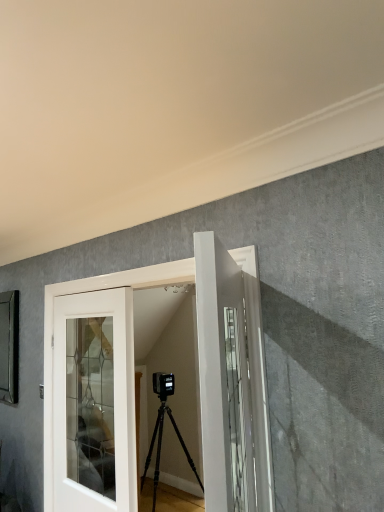
Measure the distance between point [114,305] and camera.

Point [114,305] is 2.16 meters from camera.

This screenshot has width=384, height=512. Find the location of `white glass door at center, which is the first door from back to front`. white glass door at center, which is the first door from back to front is located at coordinates (95, 396).

From a real-world perspective, is white glossy door at center, the second door viewed from the back, on white glass door at center, which is the first door from back to front?

Indeed, from a real-world perspective, white glossy door at center, the second door viewed from the back, stands above white glass door at center, which is the first door from back to front.

Considering the positions of objects white glossy door at center, the second door viewed from the back, and white glass door at center, which is the first door from back to front, in the image provided, who is more to the left, white glossy door at center, the second door viewed from the back, or white glass door at center, which is the first door from back to front,?

white glass door at center, which is the first door from back to front, is more to the left.

Looking at their sizes, would you say white glossy door at center, the 2th door viewed from the front, is wider or thinner than white glass door at center, marked as the third door in a front-to-back arrangement?

white glossy door at center, the 2th door viewed from the front, is wider than white glass door at center, marked as the third door in a front-to-back arrangement.

From the image's perspective, is white glossy door at center, the second door viewed from the back, located above white glossy door at center, placed as the third door when sorted from back to front?

Actually, white glossy door at center, the second door viewed from the back, appears below white glossy door at center, placed as the third door when sorted from back to front, in the image.

Considering the sizes of white glossy door at center, the second door viewed from the back, and white glossy door at center, placed as the third door when sorted from back to front, in the image, is white glossy door at center, the second door viewed from the back, wider or thinner than white glossy door at center, placed as the third door when sorted from back to front,?

In the image, white glossy door at center, the second door viewed from the back, appears to be wider than white glossy door at center, placed as the third door when sorted from back to front.

Considering the sizes of objects white glossy door at center, the second door viewed from the back, and white glossy door at center, which is the 1th door from front to back, in the image provided, who is smaller, white glossy door at center, the second door viewed from the back, or white glossy door at center, which is the 1th door from front to back,?

Smaller between the two is white glossy door at center, which is the 1th door from front to back.

Can you confirm if white glossy door at center, the 2th door viewed from the front, is positioned to the right of white glossy door at center, which is the 1th door from front to back?

No, white glossy door at center, the 2th door viewed from the front, is not to the right of white glossy door at center, which is the 1th door from front to back.

From the picture: Can you confirm if white glossy door at center, which is the 1th door from front to back, is shorter than white glossy door at center, the second door viewed from the back?

Yes.

Would you say white glossy door at center, which is the 1th door from front to back, is outside white glossy door at center, the second door viewed from the back?

Yes.

Are white glossy door at center, which is the 1th door from front to back, and white glossy door at center, the 2th door viewed from the front, located far from each other?

No, white glossy door at center, which is the 1th door from front to back, is not far from white glossy door at center, the 2th door viewed from the front.

Is white glass door at center, marked as the third door in a front-to-back arrangement, not inside white glossy door at center, placed as the third door when sorted from back to front?

Yes, white glass door at center, marked as the third door in a front-to-back arrangement, is located beyond the bounds of white glossy door at center, placed as the third door when sorted from back to front.

Can you confirm if white glass door at center, which is the first door from back to front, is smaller than white glossy door at center, which is the 1th door from front to back?

No.

From the white glossy door at center, placed as the third door when sorted from back to front, count 2nd doors backward and point to it. Please provide its 2D coordinates.

[(95, 396)]

How much distance is there between white glass door at center, which is the first door from back to front, and white glossy door at center, placed as the third door when sorted from back to front?

They are 1.25 meters apart.

Which object is further away from the camera taking this photo, white glossy door at center, which is the 1th door from front to back, or white glass door at center, marked as the third door in a front-to-back arrangement?

white glass door at center, marked as the third door in a front-to-back arrangement.

Based on their positions, is white glossy door at center, placed as the third door when sorted from back to front, located to the left or right of white glass door at center, marked as the third door in a front-to-back arrangement?

white glossy door at center, placed as the third door when sorted from back to front, is positioned on white glass door at center, marked as the third door in a front-to-back arrangement,'s right side.

Considering the relative sizes of white glossy door at center, placed as the third door when sorted from back to front, and white glass door at center, which is the first door from back to front, in the image provided, is white glossy door at center, placed as the third door when sorted from back to front, thinner than white glass door at center, which is the first door from back to front,?

No.

Is white glossy door at center, placed as the third door when sorted from back to front, next to white glass door at center, marked as the third door in a front-to-back arrangement, and touching it?

No, white glossy door at center, placed as the third door when sorted from back to front, is not touching white glass door at center, marked as the third door in a front-to-back arrangement.

Looking at this image, from a real-world perspective, which object rests below the other?

From a 3D spatial view, white glass door at center, marked as the third door in a front-to-back arrangement, is below.

Is the position of white glass door at center, marked as the third door in a front-to-back arrangement, less distant than that of white glossy door at center, the 2th door viewed from the front?

No, it is behind white glossy door at center, the 2th door viewed from the front.

Is white glass door at center, marked as the third door in a front-to-back arrangement, oriented away from white glossy door at center, the second door viewed from the back?

Correct, white glass door at center, marked as the third door in a front-to-back arrangement, is looking away from white glossy door at center, the second door viewed from the back.

The height and width of the screenshot is (512, 384). What are the coordinates of `door that is below the white glossy door at center, the second door viewed from the back (from the image's perspective)` in the screenshot? It's located at (95, 396).

Locate an element on the screen. door behind the white glossy door at center, the second door viewed from the back is located at coordinates (95, 396).

You are a GUI agent. You are given a task and a screenshot of the screen. Output one action in this format:
    pyautogui.click(x=<x>, y=<y>)
    Task: Click on the door located above the white glossy door at center, the second door viewed from the back (from the image's perspective)
    Image resolution: width=384 pixels, height=512 pixels.
    Given the screenshot: What is the action you would take?
    pyautogui.click(x=223, y=379)

When comparing their distances from white glossy door at center, the second door viewed from the back, does white glass door at center, which is the first door from back to front, or white glossy door at center, placed as the third door when sorted from back to front, seem further?

Based on the image, white glossy door at center, placed as the third door when sorted from back to front, appears to be further to white glossy door at center, the second door viewed from the back.

From the image, which object appears to be farther from white glass door at center, marked as the third door in a front-to-back arrangement, white glossy door at center, the 2th door viewed from the front, or white glossy door at center, placed as the third door when sorted from back to front?

Among the two, white glossy door at center, placed as the third door when sorted from back to front, is located further to white glass door at center, marked as the third door in a front-to-back arrangement.

Based on their spatial positions, is white glossy door at center, the second door viewed from the back, or white glass door at center, which is the first door from back to front, further from white glossy door at center, placed as the third door when sorted from back to front?

white glass door at center, which is the first door from back to front, is positioned further to the anchor white glossy door at center, placed as the third door when sorted from back to front.

Which object lies nearer to the anchor point white glossy door at center, which is the 1th door from front to back, white glass door at center, marked as the third door in a front-to-back arrangement, or white glossy door at center, the 2th door viewed from the front?

Based on the image, white glossy door at center, the 2th door viewed from the front, appears to be nearer to white glossy door at center, which is the 1th door from front to back.

In the scene shown: From the image, which object appears to be nearer to white glass door at center, which is the first door from back to front, white glossy door at center, placed as the third door when sorted from back to front, or white glossy door at center, the 2th door viewed from the front?

white glossy door at center, the 2th door viewed from the front.

Looking at the image, which one is located further to white glossy door at center, the second door viewed from the back, white glossy door at center, placed as the third door when sorted from back to front, or white glass door at center, which is the first door from back to front?

white glossy door at center, placed as the third door when sorted from back to front, is positioned further to the anchor white glossy door at center, the second door viewed from the back.

The height and width of the screenshot is (512, 384). Identify the location of door between white glossy door at center, placed as the third door when sorted from back to front, and white glass door at center, marked as the third door in a front-to-back arrangement, from front to back. (53, 335).